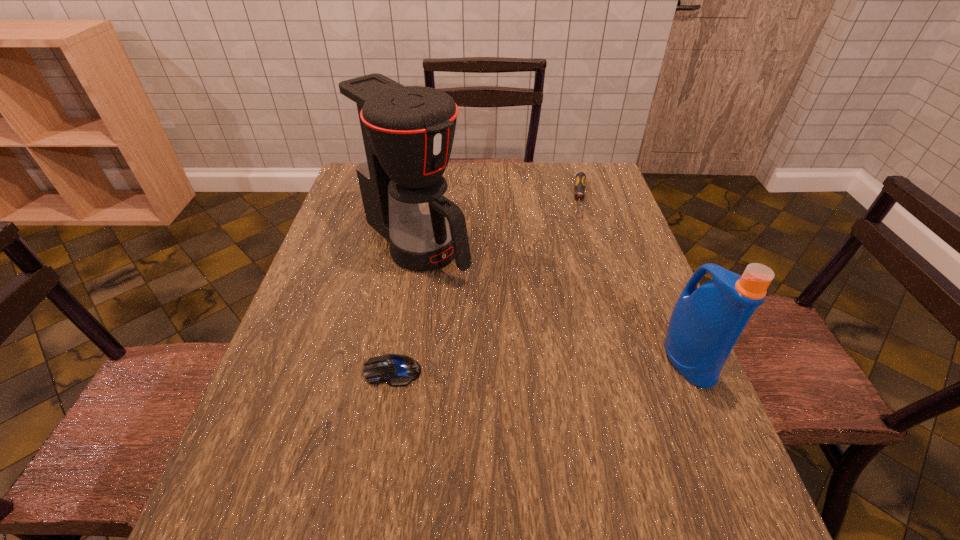
You are a GUI agent. You are given a task and a screenshot of the screen. Output one action in this format:
    pyautogui.click(x=<x>, y=<y>)
    Task: Click on the free space located 0.180m insert the second object from right to left into a screw head
    
    Given the screenshot: What is the action you would take?
    pyautogui.click(x=584, y=259)

At what (x,y) coordinates should I click in order to perform the action: click on vacant point located 0.370m insert the second object from right to left into a screw head. Please return your answer as a coordinate pair (x, y). This screenshot has height=540, width=960. Looking at the image, I should click on (581, 310).

The height and width of the screenshot is (540, 960). In order to click on blank space located insert the second object from right to left into a screw head in this screenshot , I will do `click(585, 239)`.

Find the location of a particular element. object at the far edge is located at coordinates (580, 183).

Image resolution: width=960 pixels, height=540 pixels. I want to click on object that is at the left edge, so click(401, 137).

You are a GUI agent. You are given a task and a screenshot of the screen. Output one action in this format:
    pyautogui.click(x=<x>, y=<y>)
    Task: Click on the detergent that is positioned at the right edge
    
    Given the screenshot: What is the action you would take?
    pyautogui.click(x=706, y=322)

Identify the location of screwdriver situated at the right edge. The width and height of the screenshot is (960, 540). (x=580, y=183).

Locate an element on the screen. This screenshot has width=960, height=540. object that is positioned at the far right corner is located at coordinates (580, 183).

Where is `free spot at the far edge of the desktop`? The height and width of the screenshot is (540, 960). free spot at the far edge of the desktop is located at coordinates (513, 188).

The height and width of the screenshot is (540, 960). I want to click on vacant area at the near edge, so click(341, 442).